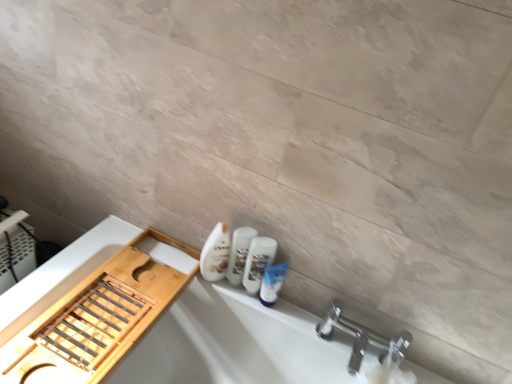
Question: Considering the positions of white glossy bottle at center and chrome metallic faucet at lower right in the image, is white glossy bottle at center taller or shorter than chrome metallic faucet at lower right?

Choices:
 (A) short
 (B) tall

Answer: (B)

Question: Looking at the image, does white glossy bottle at center seem bigger or smaller compared to chrome metallic faucet at lower right?

Choices:
 (A) small
 (B) big

Answer: (A)

Question: Estimate the real-world distances between objects in this image. Which object is farther from the white matte bathtub at lower left?

Choices:
 (A) white glossy bottle at center
 (B) white glossy mouthwash at lower center, positioned as the second mouthwash in right-to-left order
 (C) chrome metallic faucet at lower right
 (D) white glossy mouthwash at lower right, which is counted as the 1th mouthwash, starting from the right

Answer: (C)

Question: Which object is positioned farthest from the white glossy bottle at center?

Choices:
 (A) white glossy mouthwash at lower center, positioned as the second mouthwash in right-to-left order
 (B) white glossy mouthwash at lower right, which is counted as the 1th mouthwash, starting from the right
 (C) white matte bathtub at lower left
 (D) chrome metallic faucet at lower right

Answer: (D)